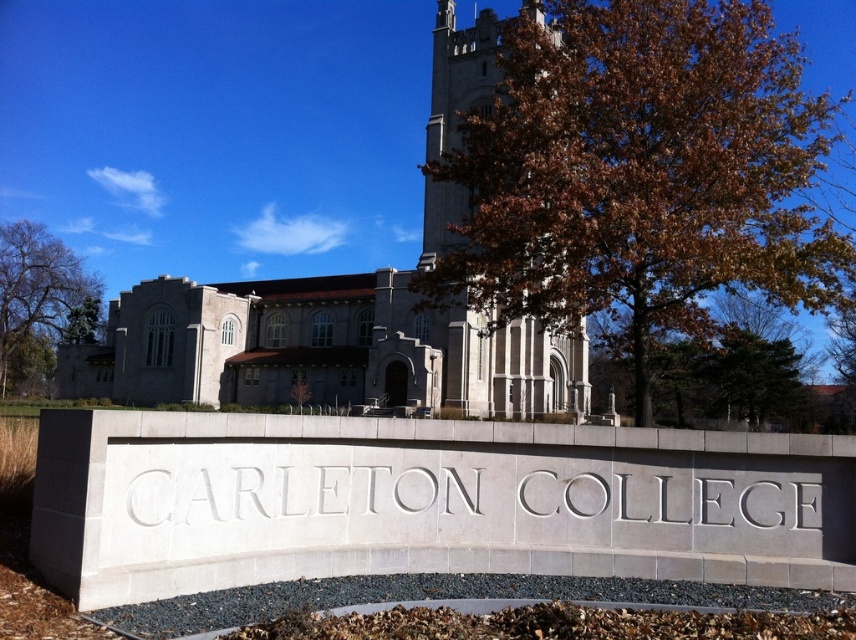
You are a tourist standing in front of the CARLETON COLLEGE sign at the base of the structure. You notice the gray stone church at center and the gray stone tower at center. Which one appears taller from your vantage point?

The gray stone tower at center appears taller than the gray stone church at center from your vantage point because the gray stone church at center is not as tall as the gray stone tower at center.

You are a visitor at Carleton College and want to take a photo that includes both the gray stone church at center and the gray stone tower at center. Given that your camera has a maximum focus range of 30 feet, will you be able to capture both in a single shot from your current position?

The distance between the gray stone church at center and the gray stone tower at center is 34.59 feet, which exceeds the camera maximum focus range of 30 feet. Therefore, you cannot capture both in a single shot from your current position.